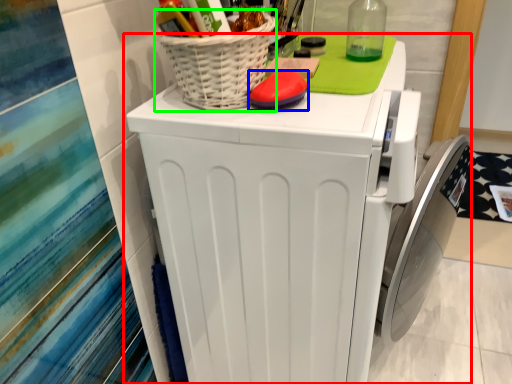
Question: Considering the real-world distances, which object is farthest from home appliance (highlighted by a red box)? soap (highlighted by a blue box) or basket (highlighted by a green box)?

Choices:
 (A) soap
 (B) basket

Answer: (A)